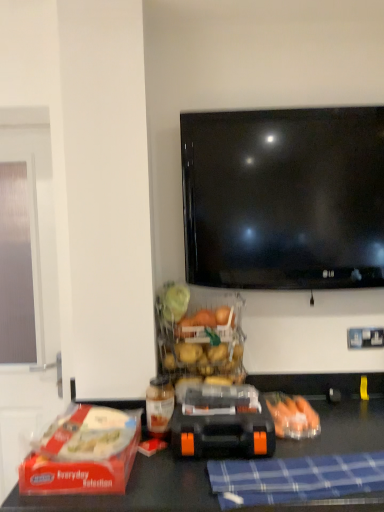
Question: Is red plastic lunch box at lower left shorter than blue checkered cloth at lower center?

Choices:
 (A) no
 (B) yes

Answer: (A)

Question: Can you confirm if red plastic lunch box at lower left is bigger than blue checkered cloth at lower center?

Choices:
 (A) yes
 (B) no

Answer: (A)

Question: Is red plastic lunch box at lower left smaller than blue checkered cloth at lower center?

Choices:
 (A) no
 (B) yes

Answer: (A)

Question: Is blue checkered cloth at lower center at the back of red plastic lunch box at lower left?

Choices:
 (A) yes
 (B) no

Answer: (B)

Question: From the image's perspective, is red plastic lunch box at lower left beneath blue checkered cloth at lower center?

Choices:
 (A) yes
 (B) no

Answer: (B)

Question: Considering the positions of translucent plastic carrots at lower right and red plastic lunch box at lower left in the image, is translucent plastic carrots at lower right wider or thinner than red plastic lunch box at lower left?

Choices:
 (A) wide
 (B) thin

Answer: (B)

Question: Considering the relative positions of translucent plastic carrots at lower right and red plastic lunch box at lower left in the image provided, is translucent plastic carrots at lower right to the left or to the right of red plastic lunch box at lower left?

Choices:
 (A) left
 (B) right

Answer: (B)

Question: Is translucent plastic carrots at lower right bigger or smaller than red plastic lunch box at lower left?

Choices:
 (A) big
 (B) small

Answer: (B)

Question: Relative to red plastic lunch box at lower left, is translucent plastic carrots at lower right in front or behind?

Choices:
 (A) behind
 (B) front

Answer: (A)

Question: From the image's perspective, relative to red plastic lunch box at lower left, is blue checkered cloth at lower center above or below?

Choices:
 (A) below
 (B) above

Answer: (A)

Question: Is blue checkered cloth at lower center in front of or behind red plastic lunch box at lower left in the image?

Choices:
 (A) behind
 (B) front

Answer: (B)

Question: Is blue checkered cloth at lower center inside the boundaries of red plastic lunch box at lower left, or outside?

Choices:
 (A) inside
 (B) outside

Answer: (B)

Question: Is point (309, 475) closer or farther from the camera than point (38, 474)?

Choices:
 (A) closer
 (B) farther

Answer: (B)

Question: From the image's perspective, is translucent plastic bottle at center above or below orange rubber toy car at center?

Choices:
 (A) above
 (B) below

Answer: (A)

Question: In terms of width, does translucent plastic bottle at center look wider or thinner when compared to orange rubber toy car at center?

Choices:
 (A) wide
 (B) thin

Answer: (B)